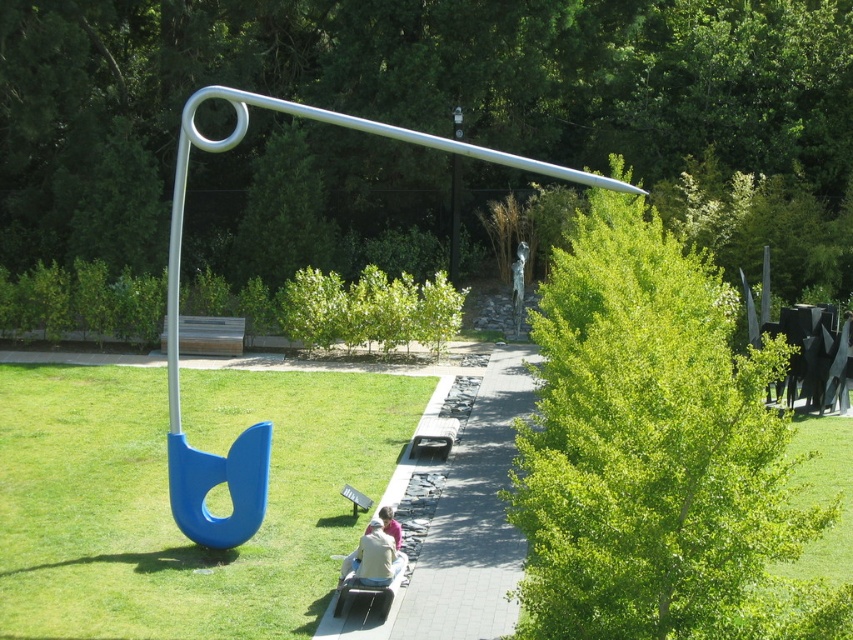
Based on the photo, can you confirm if green leafy tree at upper center is taller than paved stone path at center?

Correct, green leafy tree at upper center is much taller as paved stone path at center.

Can you confirm if green leafy tree at upper center is shorter than paved stone path at center?

No.

What do you see at coordinates (404, 92) in the screenshot? The height and width of the screenshot is (640, 853). I see `green leafy tree at upper center` at bounding box center [404, 92].

Identify the location of green leafy tree at upper center. (404, 92).

Does metallic silver bench at center have a greater height compared to metallic gray bench at center?

Yes.

Which is behind, point (241, 337) or point (416, 433)?

Point (241, 337)

Locate an element on the screen. metallic silver bench at center is located at coordinates (210, 336).

Does green leafy tree at upper center appear over light brown leather jacket at center?

Correct, green leafy tree at upper center is located above light brown leather jacket at center.

Can you confirm if green leafy tree at upper center is taller than light brown leather jacket at center?

Yes.

Between point (759, 35) and point (347, 560), which one is positioned in front?

Point (347, 560) is in front.

You are a GUI agent. You are given a task and a screenshot of the screen. Output one action in this format:
    pyautogui.click(x=<x>, y=<y>)
    Task: Click on the green leafy tree at upper center
    The width and height of the screenshot is (853, 640).
    Given the screenshot: What is the action you would take?
    pyautogui.click(x=404, y=92)